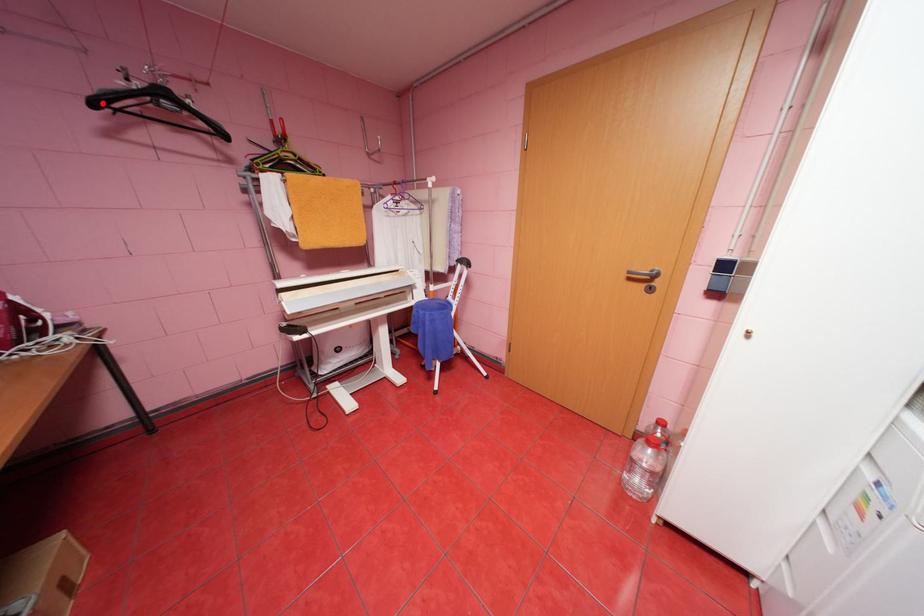
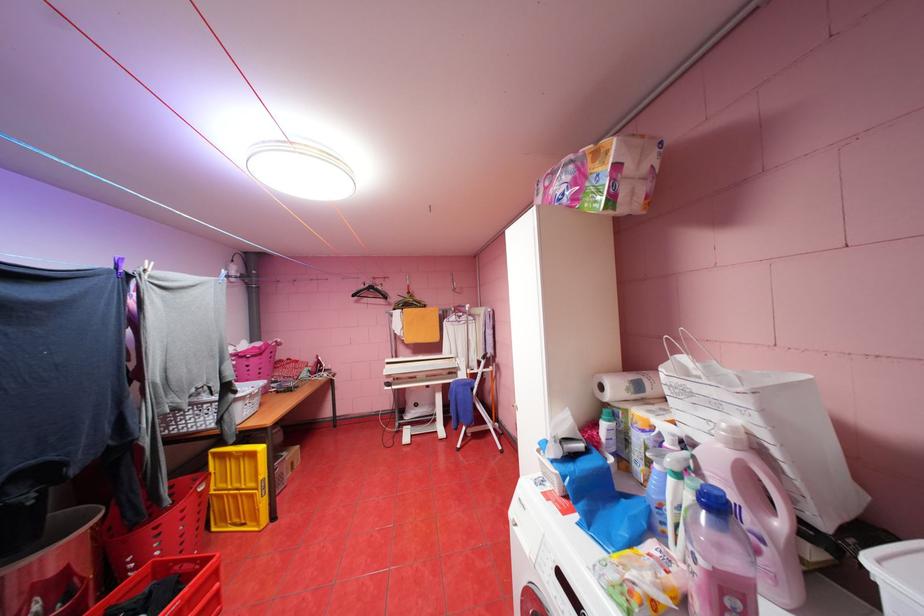
Question: A red point is marked in image1. In image2, is the corresponding 3D point closer to the camera or farther? Reply with the corresponding letter.

Choices:
 (A) The corresponding 3D point is closer.
 (B) The corresponding 3D point is farther.

Answer: (A)